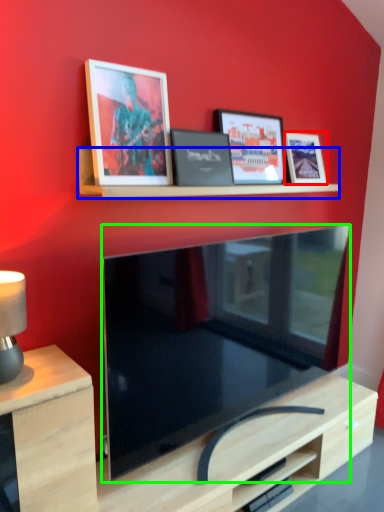
Question: Considering the real-world distances, which object is farthest from picture frame (highlighted by a red box)? shelf (highlighted by a blue box) or television (highlighted by a green box)?

Choices:
 (A) shelf
 (B) television

Answer: (B)